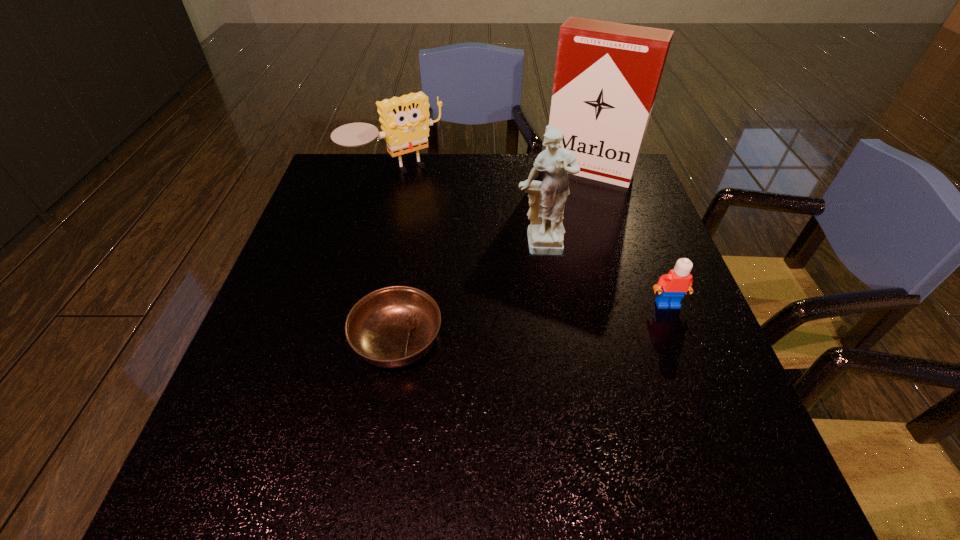
Find the location of `vacant region located on the front-facing side of the third shortest object`. vacant region located on the front-facing side of the third shortest object is located at coordinates click(468, 253).

The image size is (960, 540). Identify the location of vacant space situated on the front-facing side of the tallest object. (548, 233).

I want to click on free spot located 0.250m on the front-facing side of the tallest object, so click(545, 238).

At what (x,y) coordinates should I click in order to perform the action: click on blank area located on the front-facing side of the tallest object. Please return your answer as a coordinate pair (x, y). Looking at the image, I should click on (555, 222).

Locate an element on the screen. This screenshot has height=540, width=960. vacant space positioned on the front-facing side of the figurine is located at coordinates (562, 350).

Where is `free space located 0.100m on the front-facing side of the figurine`? This screenshot has height=540, width=960. free space located 0.100m on the front-facing side of the figurine is located at coordinates (550, 298).

The image size is (960, 540). I want to click on vacant space located on the front-facing side of the figurine, so click(x=566, y=372).

The height and width of the screenshot is (540, 960). I want to click on sponge located at the far edge, so click(405, 122).

Identify the location of cigarette_case that is positioned at the far edge. (607, 74).

What are the coordinates of `object at the left edge` in the screenshot? It's located at (405, 122).